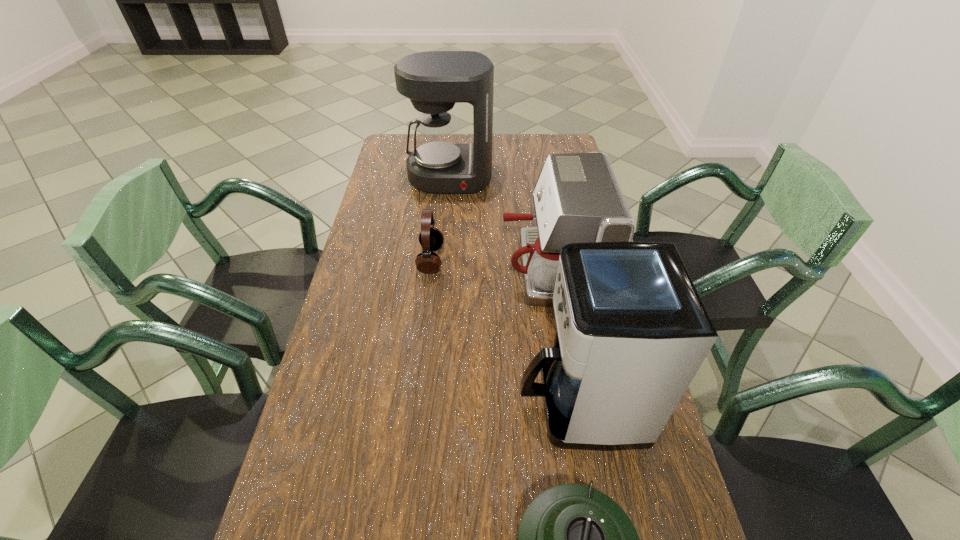
Find the location of a particular element. This screenshot has width=960, height=540. the leftmost coffee maker is located at coordinates (434, 81).

Find the location of a particular element. Image resolution: width=960 pixels, height=540 pixels. the farthest object is located at coordinates coord(434,81).

The height and width of the screenshot is (540, 960). I want to click on the nearest coffee maker, so click(632, 332).

Identify the location of the second nearest coffee maker. (577, 199).

The image size is (960, 540). I want to click on the shortest object, so click(x=430, y=238).

Image resolution: width=960 pixels, height=540 pixels. What are the coordinates of `vacant space located 0.400m on the button side of the farthest coffee maker` in the screenshot? It's located at (442, 275).

This screenshot has height=540, width=960. Identify the location of vacant space located on the front panel of the nearest coffee maker. (348, 403).

Where is `free space located 0.150m on the front panel of the nearest coffee maker`? This screenshot has height=540, width=960. free space located 0.150m on the front panel of the nearest coffee maker is located at coordinates (453, 403).

Identify the location of free space located on the front panel of the nearest coffee maker. The height and width of the screenshot is (540, 960). (453, 403).

Locate an element on the screen. vacant area situated 0.220m on the front of the shortest coffee maker near the spout is located at coordinates [428, 268].